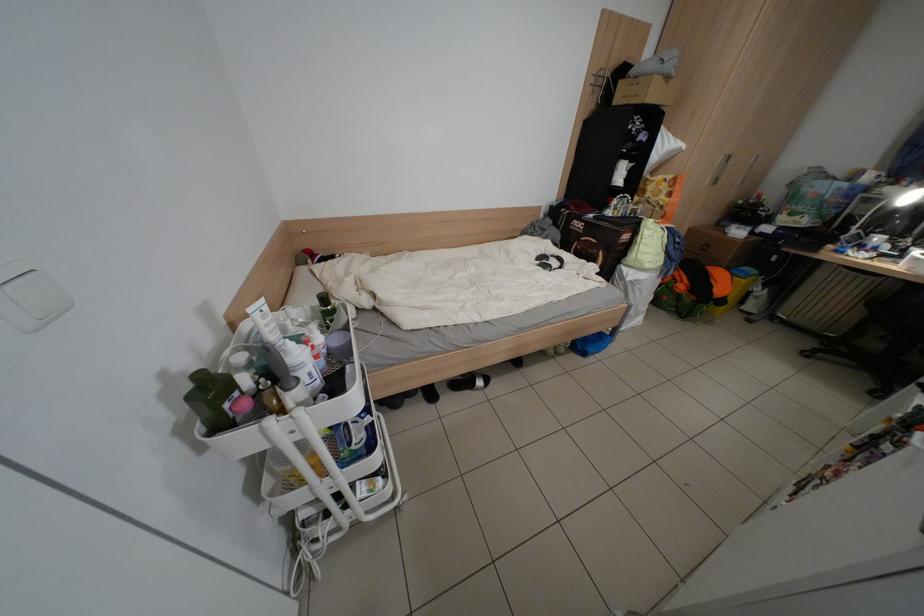
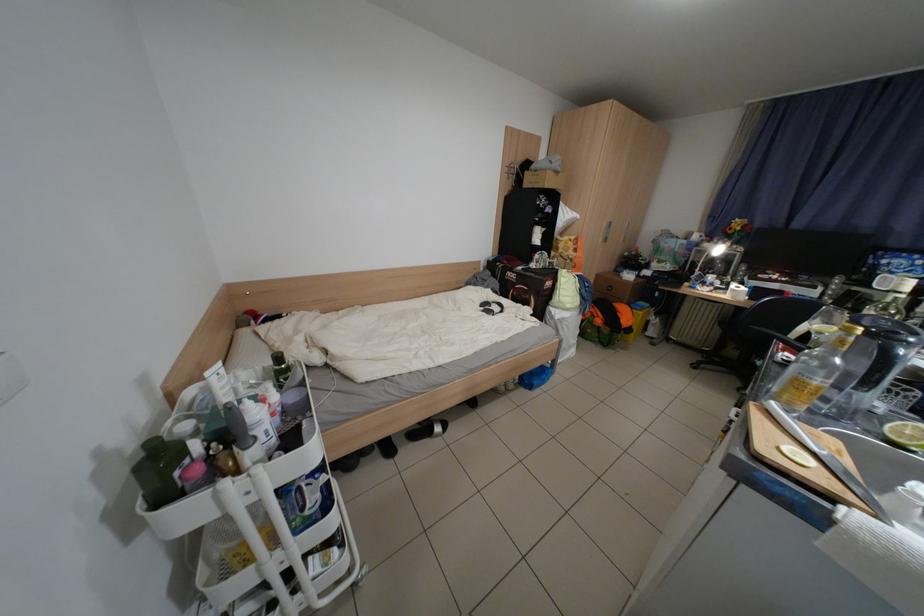
In the second image, find the point that corresponds to [304,411] in the first image.

(261, 469)